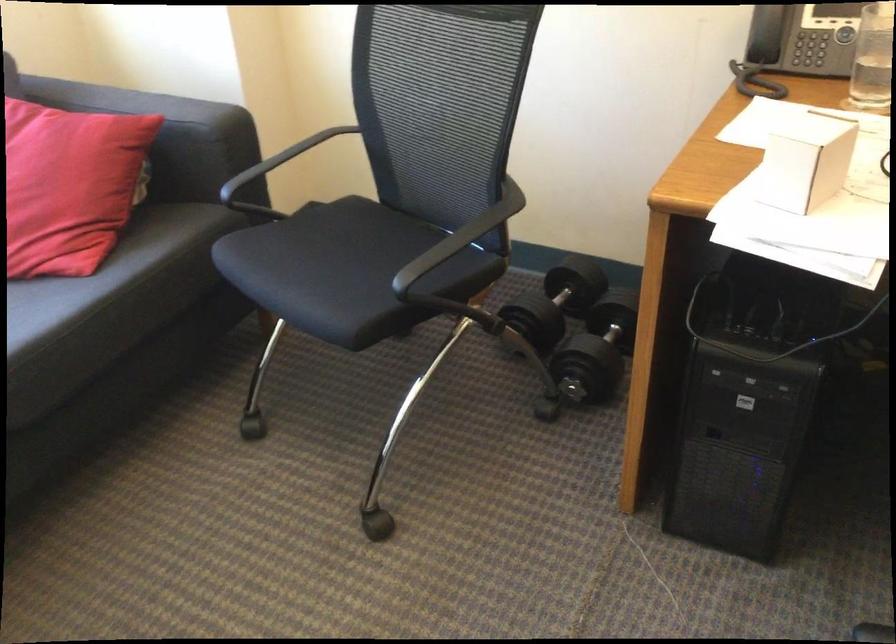
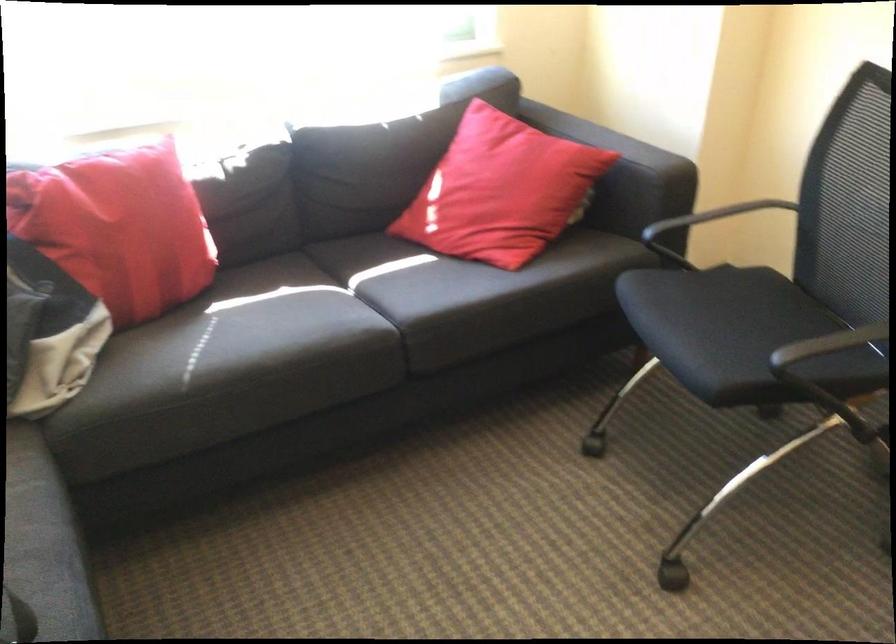
The point at (x=351, y=269) is marked in the first image. Where is the corresponding point in the second image?

(737, 333)